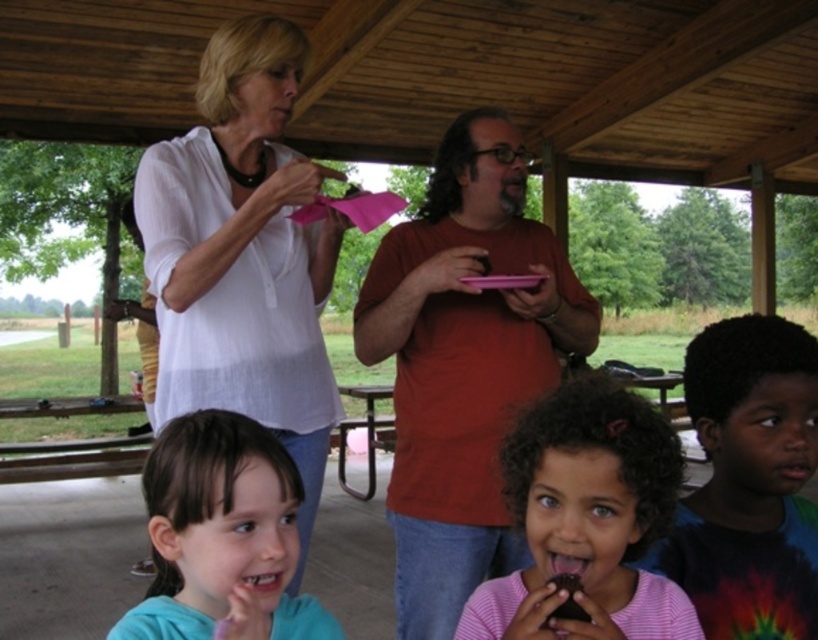
Is the position of white matte shirt at upper left less distant than that of pink striped shirt at lower center?

No, white matte shirt at upper left is further to the viewer.

Is white matte shirt at upper left bigger than pink striped shirt at lower center?

Yes.

Which is behind, point (149, 237) or point (625, 390)?

The point (149, 237) is behind.

The width and height of the screenshot is (818, 640). Find the location of `white matte shirt at upper left`. white matte shirt at upper left is located at coordinates (243, 253).

Which is more to the right, white matte shirt at upper left or smooth teal shirt at lower left?

Positioned to the right is smooth teal shirt at lower left.

In the scene shown: Who is higher up, white matte shirt at upper left or smooth teal shirt at lower left?

white matte shirt at upper left is above.

Where is `white matte shirt at upper left`? The image size is (818, 640). white matte shirt at upper left is located at coordinates (243, 253).

Can you confirm if matte red shirt at center is bigger than pink striped shirt at lower center?

Indeed, matte red shirt at center has a larger size compared to pink striped shirt at lower center.

Which is more to the right, matte red shirt at center or pink striped shirt at lower center?

From the viewer's perspective, pink striped shirt at lower center appears more on the right side.

You are a GUI agent. You are given a task and a screenshot of the screen. Output one action in this format:
    pyautogui.click(x=<x>, y=<y>)
    Task: Click on the matte red shirt at center
    
    Given the screenshot: What is the action you would take?
    pyautogui.click(x=463, y=362)